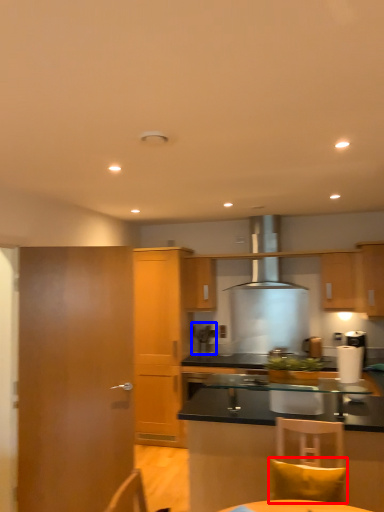
Question: Which of the following is the farthest to the observer, pillow (highlighted by a red box) or coffee machine (highlighted by a blue box)?

Choices:
 (A) pillow
 (B) coffee machine

Answer: (B)